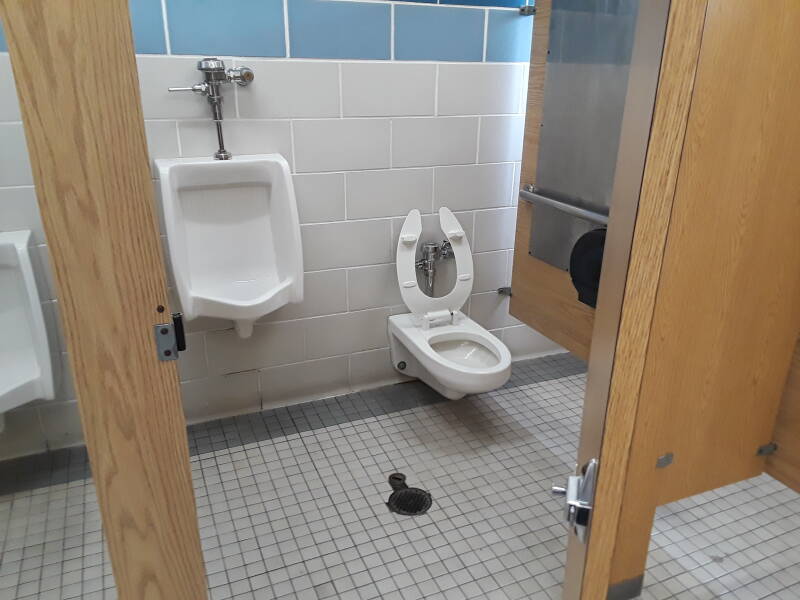
Find the location of `bowl`. bowl is located at coordinates (469, 356), (21, 381), (252, 295).